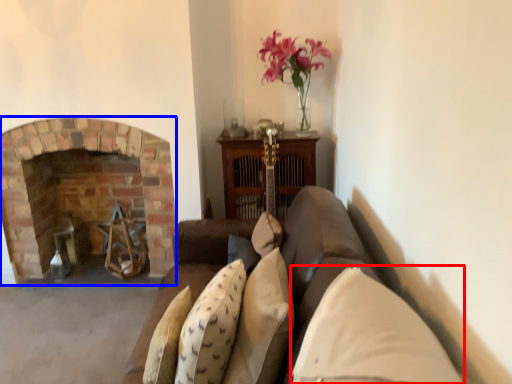
Question: Which point is further to the camera, pillow (highlighted by a red box) or fireplace (highlighted by a blue box)?

Choices:
 (A) pillow
 (B) fireplace

Answer: (B)